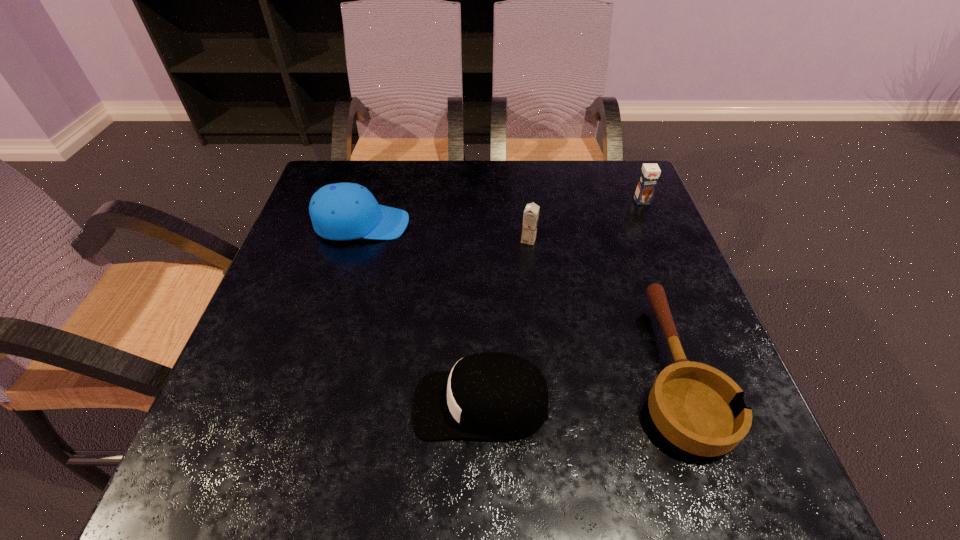
Identify the location of free point located on the front-facing side of the nearer cap. (273, 404).

This screenshot has height=540, width=960. What are the coordinates of `vacant space located on the front-facing side of the nearer cap` in the screenshot? It's located at (237, 404).

At what (x,y) coordinates should I click in order to perform the action: click on vacant space located on the front-facing side of the nearer cap. Please return your answer as a coordinate pair (x, y). This screenshot has width=960, height=540. Looking at the image, I should click on (260, 404).

Locate an element on the screen. vacant space situated 0.360m with the handle on the side of the shortest object is located at coordinates (612, 198).

At what (x,y) coordinates should I click in order to perform the action: click on vacant space located 0.200m with the handle on the side of the shortest object. Please return your answer as a coordinate pair (x, y). The height and width of the screenshot is (540, 960). Looking at the image, I should click on (625, 238).

The image size is (960, 540). I want to click on vacant area located 0.290m with the handle on the side of the shortest object, so click(617, 214).

Find the location of `cap positioned at the far edge`. cap positioned at the far edge is located at coordinates (342, 211).

Identify the location of chocolate milk that is at the far edge. The image size is (960, 540). (649, 175).

Locate an element on the screen. cap at the near edge is located at coordinates (491, 395).

At what (x,y) coordinates should I click in order to perform the action: click on saucepan that is at the near edge. Please return your answer as a coordinate pair (x, y). Image resolution: width=960 pixels, height=540 pixels. Looking at the image, I should click on tap(698, 408).